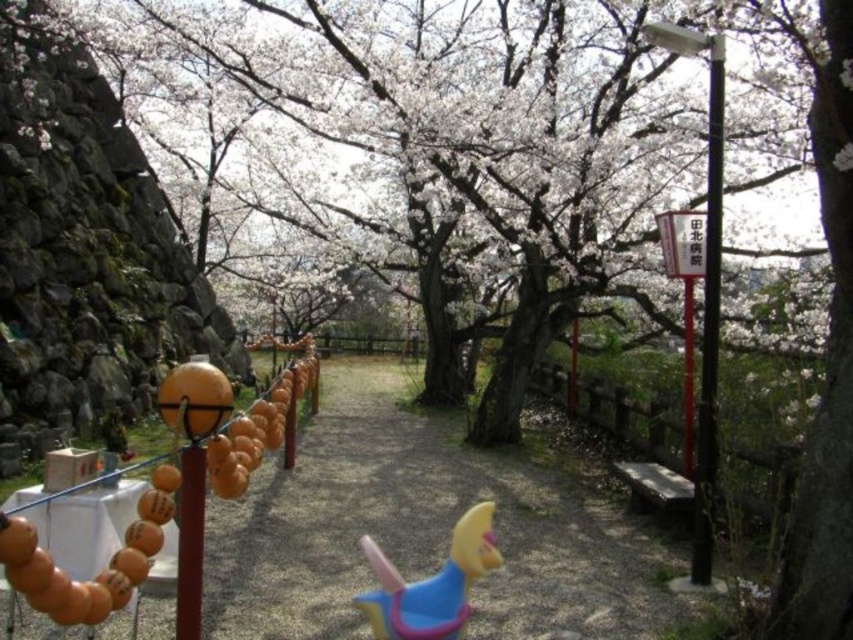
Does white blossoming tree at center have a greater height compared to matte plastic toy horse at center?

Yes, white blossoming tree at center is taller than matte plastic toy horse at center.

In order to click on white blossoming tree at center in this screenshot , I will do `click(477, 147)`.

In order to click on white blossoming tree at center in this screenshot , I will do `click(477, 147)`.

Who is more distant from viewer, (282, 576) or (403, 580)?

Result: The point (282, 576) is behind.

Is point (558, 589) behind point (465, 616)?

Yes, point (558, 589) is behind point (465, 616).

At what (x,y) coordinates should I click in order to perform the action: click on brown gravel path at center. Please return your answer as a coordinate pair (x, y). Looking at the image, I should click on (432, 529).

Can you confirm if white blossoming tree at center is bigger than brown gravel path at center?

Correct, white blossoming tree at center is larger in size than brown gravel path at center.

In the scene shown: Does white blossoming tree at center appear under brown gravel path at center?

Actually, white blossoming tree at center is above brown gravel path at center.

I want to click on white blossoming tree at center, so point(477,147).